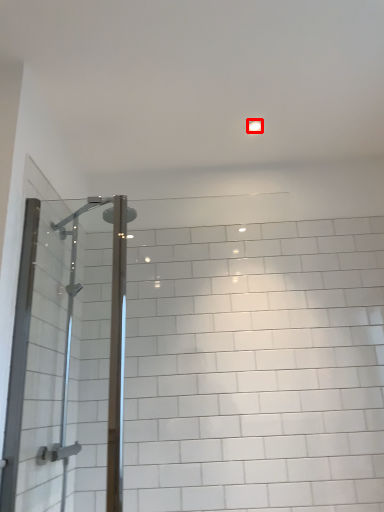
Question: Where is light fixture (annotated by the red box) located in relation to screen door in the image?

Choices:
 (A) left
 (B) right

Answer: (B)